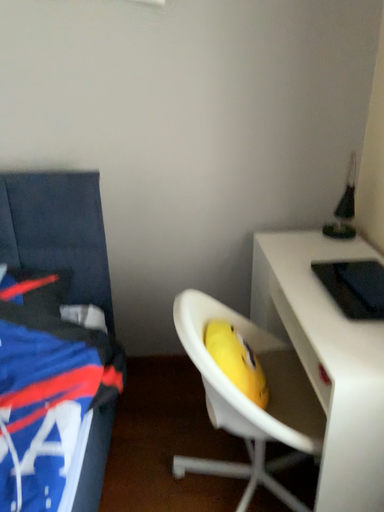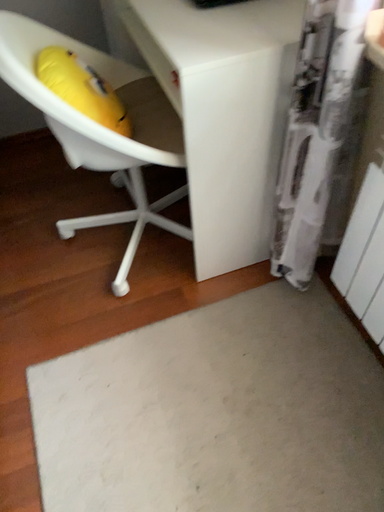
Question: How did the camera likely rotate when shooting the video?

Choices:
 (A) rotated right
 (B) rotated left

Answer: (A)